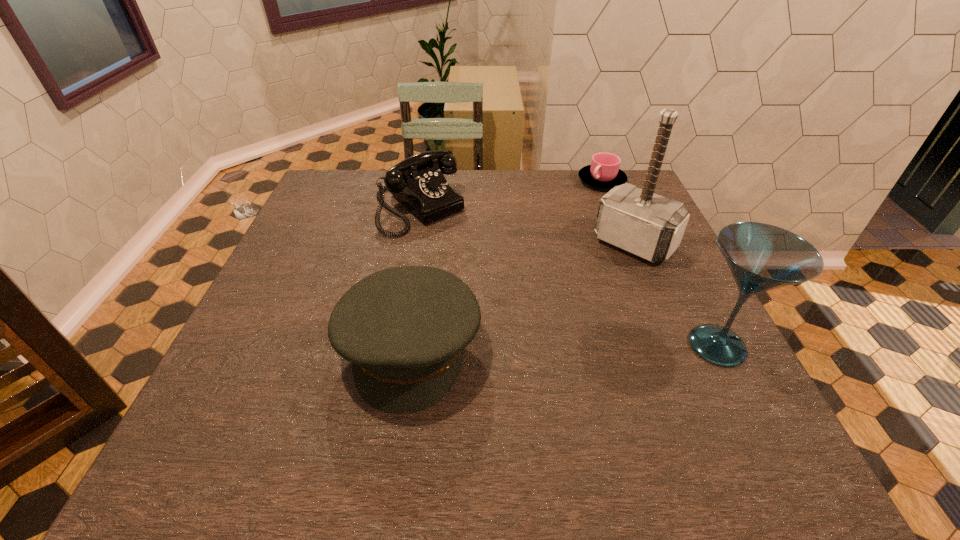
This screenshot has width=960, height=540. I want to click on beret, so click(404, 329).

This screenshot has width=960, height=540. Find the location of `the second tallest object`. the second tallest object is located at coordinates (761, 257).

Locate an element on the screen. Image resolution: width=960 pixels, height=540 pixels. telephone is located at coordinates (418, 182).

At what (x,y) coordinates should I click in order to perform the action: click on hammer. Please return your answer as a coordinate pair (x, y). This screenshot has height=540, width=960. Looking at the image, I should click on (650, 226).

The height and width of the screenshot is (540, 960). In order to click on the shortest object in this screenshot , I will do `click(604, 172)`.

Locate an element on the screen. The height and width of the screenshot is (540, 960). free spot located on the left of the fourth shortest object is located at coordinates (581, 346).

Where is `free space located on the dial of the telephone`? free space located on the dial of the telephone is located at coordinates (456, 244).

Locate an element on the screen. vacant space located 0.090m on the dial of the telephone is located at coordinates (462, 249).

Locate an element on the screen. The width and height of the screenshot is (960, 540). free spot located on the dial of the telephone is located at coordinates (478, 263).

Find the location of `vacant area situated 0.240m for striking with the head of the hammer`. vacant area situated 0.240m for striking with the head of the hammer is located at coordinates (563, 314).